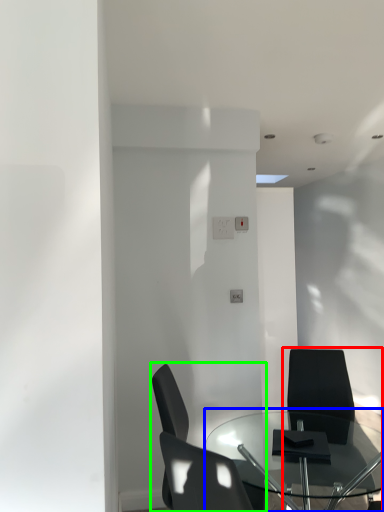
Question: Which object is positioned farthest from chair (highlighted by a red box)? Select from table (highlighted by a blue box) and chair (highlighted by a green box).

Choices:
 (A) table
 (B) chair

Answer: (B)